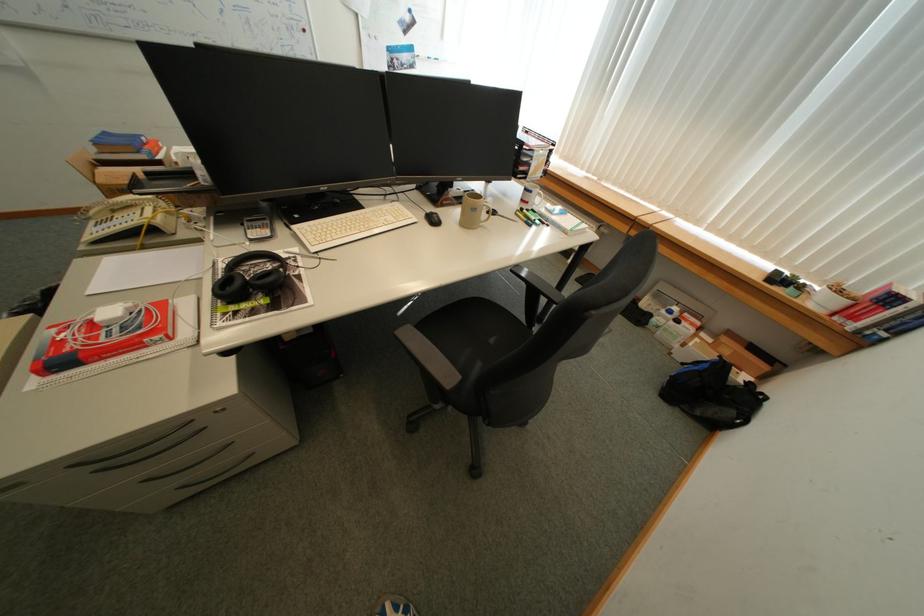
Where is `spiral-bound notebook`? Image resolution: width=924 pixels, height=616 pixels. spiral-bound notebook is located at coordinates (112, 342).